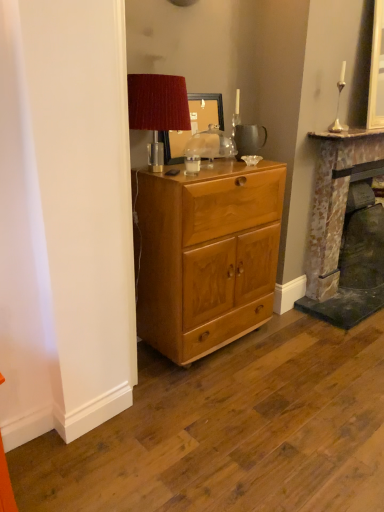
Question: From a real-world perspective, is light brown wood cabinet at center under rustic stone fireplace at right?

Choices:
 (A) yes
 (B) no

Answer: (A)

Question: Considering the relative sizes of light brown wood cabinet at center and rustic stone fireplace at right in the image provided, is light brown wood cabinet at center smaller than rustic stone fireplace at right?

Choices:
 (A) no
 (B) yes

Answer: (B)

Question: Is light brown wood cabinet at center outside rustic stone fireplace at right?

Choices:
 (A) yes
 (B) no

Answer: (A)

Question: Is light brown wood cabinet at center thinner than rustic stone fireplace at right?

Choices:
 (A) no
 (B) yes

Answer: (A)

Question: Does light brown wood cabinet at center come behind rustic stone fireplace at right?

Choices:
 (A) no
 (B) yes

Answer: (A)

Question: From a real-world perspective, is light brown wood cabinet at center positioned above or below rustic stone fireplace at right?

Choices:
 (A) above
 (B) below

Answer: (B)

Question: Is point (157, 193) closer or farther from the camera than point (349, 140)?

Choices:
 (A) closer
 (B) farther

Answer: (A)

Question: From their relative heights in the image, would you say light brown wood cabinet at center is taller or shorter than rustic stone fireplace at right?

Choices:
 (A) short
 (B) tall

Answer: (A)

Question: Considering the relative positions of light brown wood cabinet at center and rustic stone fireplace at right in the image provided, is light brown wood cabinet at center to the left or to the right of rustic stone fireplace at right?

Choices:
 (A) left
 (B) right

Answer: (A)

Question: Looking at the image, does light brown wood cabinet at center seem bigger or smaller compared to wooden picture frame at center?

Choices:
 (A) big
 (B) small

Answer: (A)

Question: Is point (230, 181) closer or farther from the camera than point (170, 138)?

Choices:
 (A) closer
 (B) farther

Answer: (A)

Question: From the image's perspective, is light brown wood cabinet at center positioned above or below wooden picture frame at center?

Choices:
 (A) above
 (B) below

Answer: (B)

Question: Considering the positions of light brown wood cabinet at center and wooden picture frame at center in the image, is light brown wood cabinet at center taller or shorter than wooden picture frame at center?

Choices:
 (A) tall
 (B) short

Answer: (A)

Question: Is point (155, 83) closer or farther from the camera than point (344, 70)?

Choices:
 (A) farther
 (B) closer

Answer: (B)

Question: From a real-world perspective, is velvet red lampshade at upper center positioned above or below silver metallic candle holder at upper right?

Choices:
 (A) above
 (B) below

Answer: (B)